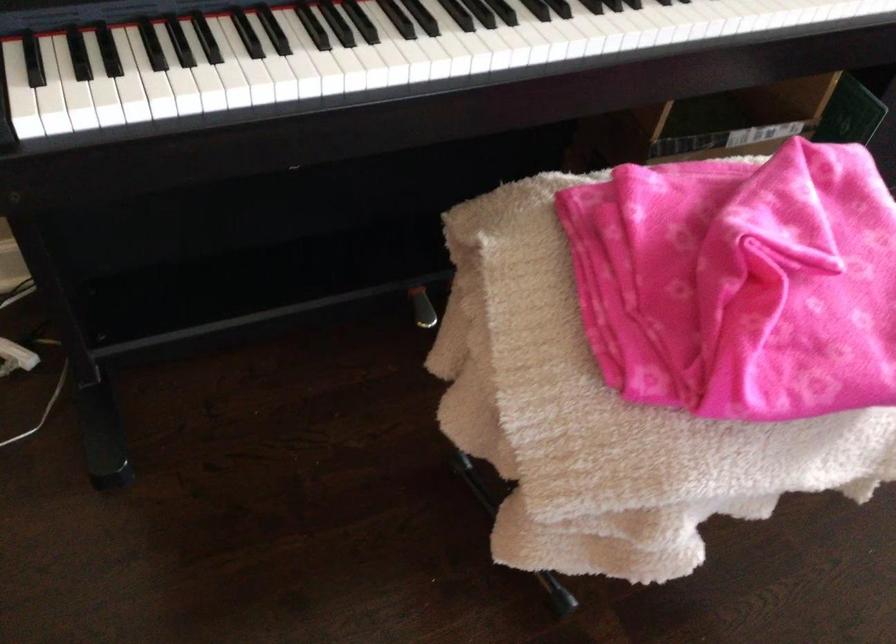
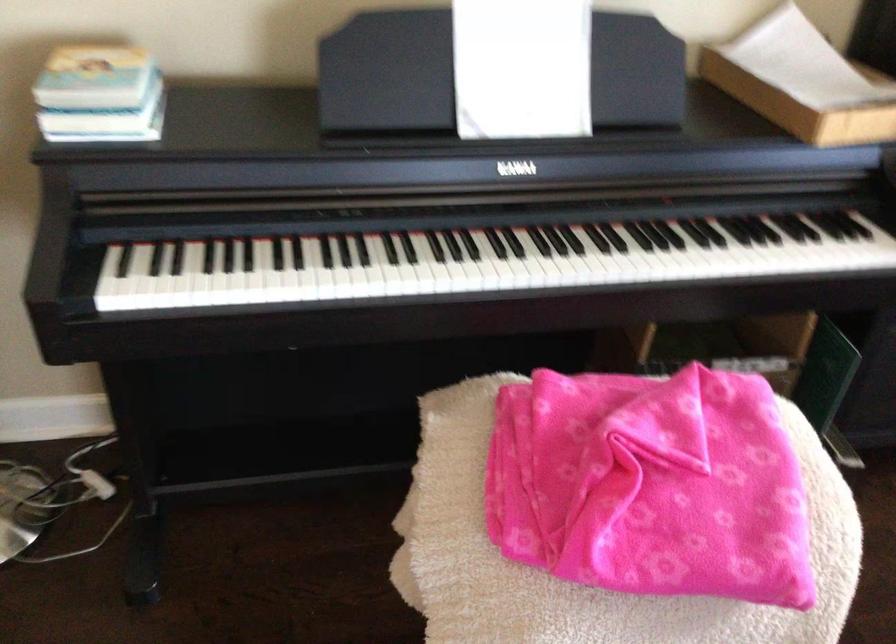
The images are taken continuously from a first-person perspective. In which direction are you moving?

The cameraman moved toward right, backward.